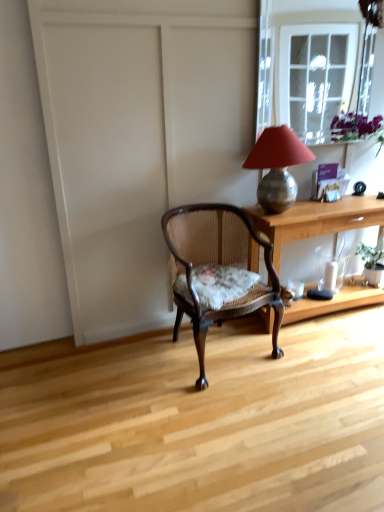
Question: Would you say wooden desk at center contains green leafy plant at right?

Choices:
 (A) yes
 (B) no

Answer: (A)

Question: From the image's perspective, is wooden desk at center on top of green leafy plant at right?

Choices:
 (A) yes
 (B) no

Answer: (A)

Question: From a real-world perspective, is wooden desk at center physically above green leafy plant at right?

Choices:
 (A) yes
 (B) no

Answer: (A)

Question: Could you tell me if wooden desk at center is facing green leafy plant at right?

Choices:
 (A) no
 (B) yes

Answer: (B)

Question: Can you confirm if wooden desk at center is wider than green leafy plant at right?

Choices:
 (A) no
 (B) yes

Answer: (B)

Question: Does point (375, 264) appear closer or farther from the camera than point (271, 236)?

Choices:
 (A) closer
 (B) farther

Answer: (B)

Question: Looking at their shapes, would you say green leafy plant at right is wider or thinner than wooden desk at center?

Choices:
 (A) wide
 (B) thin

Answer: (B)

Question: In terms of height, does green leafy plant at right look taller or shorter compared to wooden desk at center?

Choices:
 (A) tall
 (B) short

Answer: (B)

Question: From the image's perspective, is green leafy plant at right located above or below wooden desk at center?

Choices:
 (A) above
 (B) below

Answer: (B)

Question: Is wooden desk at center bigger or smaller than green leafy plant at right?

Choices:
 (A) small
 (B) big

Answer: (B)

Question: Does point (304, 221) appear closer or farther from the camera than point (370, 266)?

Choices:
 (A) closer
 (B) farther

Answer: (A)

Question: From the image's perspective, relative to green leafy plant at right, is wooden desk at center above or below?

Choices:
 (A) below
 (B) above

Answer: (B)

Question: Do you think wooden desk at center is within green leafy plant at right, or outside of it?

Choices:
 (A) inside
 (B) outside

Answer: (B)

Question: From a real-world perspective, relative to wooden desk at center, is clear glass window at upper right vertically above or below?

Choices:
 (A) above
 (B) below

Answer: (A)

Question: Looking at the image, does clear glass window at upper right seem bigger or smaller compared to wooden desk at center?

Choices:
 (A) big
 (B) small

Answer: (B)